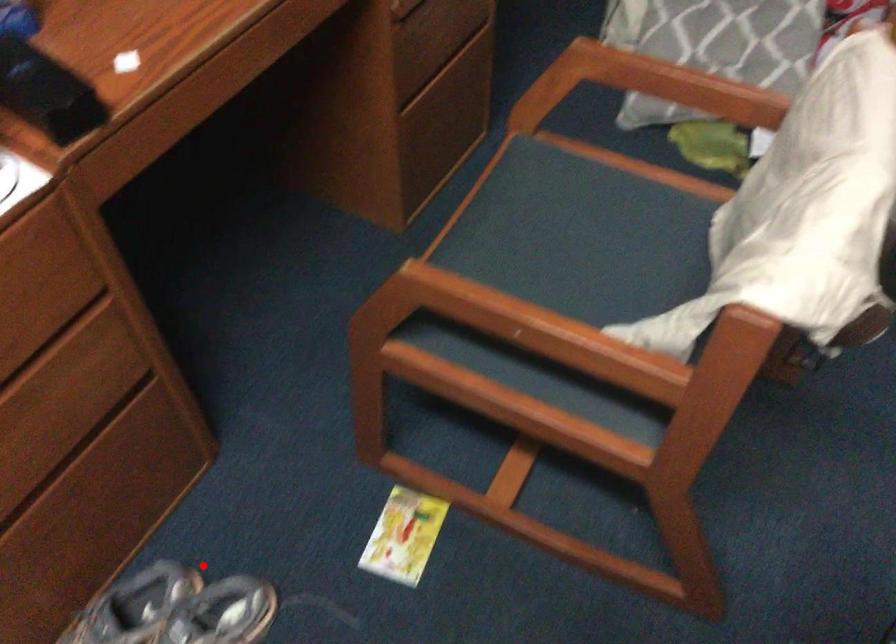
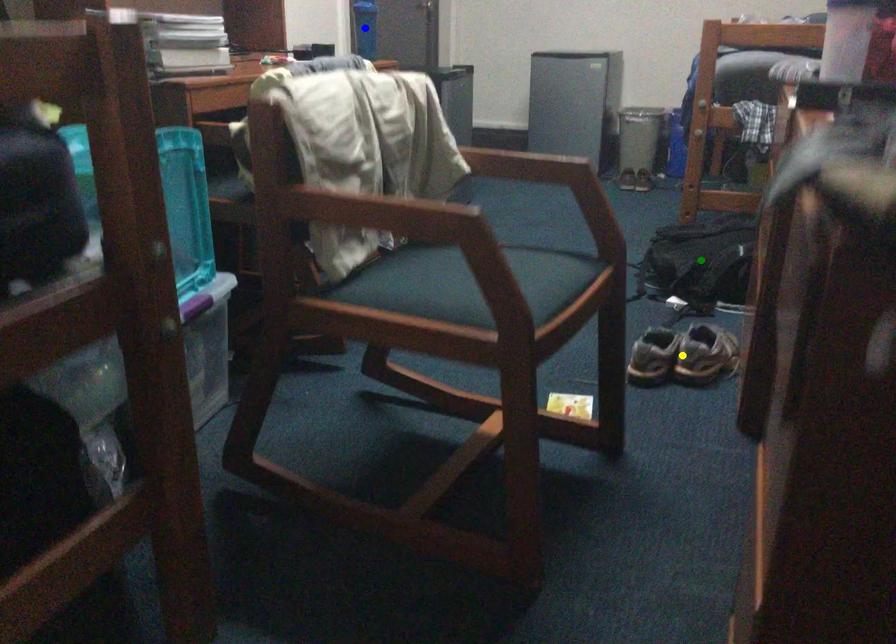
Question: I am providing you with two images of the same scene from different viewpoints. A red point is marked on the first image. You are given multiple points on the second image. Can you choose the point in image 2 that corresponds to the point in image 1?

Choices:
 (A) blue point
 (B) yellow point
 (C) green point

Answer: (B)